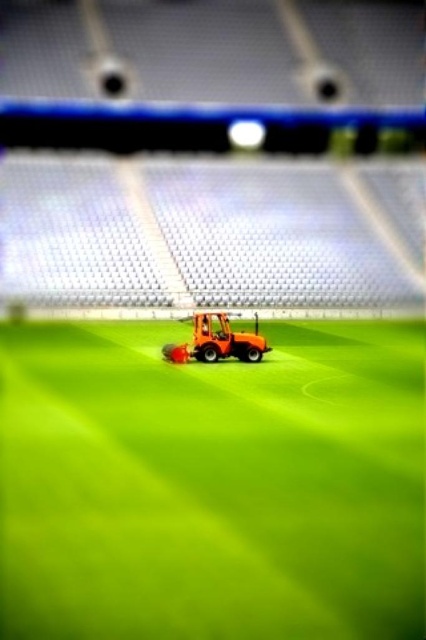
You are standing at the edge of the stadium field and want to place a small flag at each of the two points labeled point (419, 612) and point (199, 344). Which point will the flag placed at appear closer to you when viewed from your current position?

The flag placed at point (419, 612) will appear closer to you because it is closer to the camera than point (199, 344).

You are a groundskeeper in the stadium looking at the green smooth grass at center and the orange plastic lawn mower at center. Which object is taller?

The green smooth grass at center is taller than the orange plastic lawn mower at center.